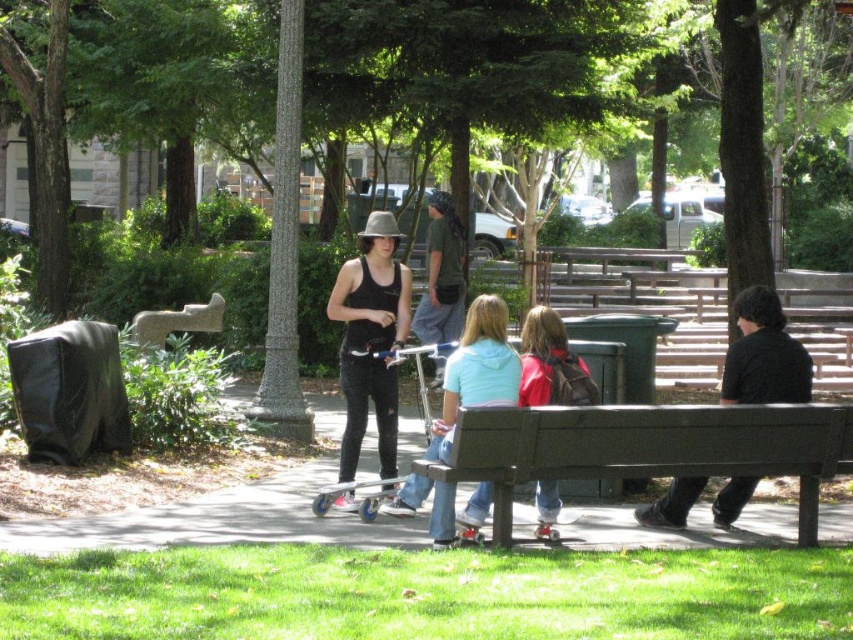
You are a photographer trying to capture a candid shot of the two people at the park. You notice the matte black tank top at center and the light blue cotton hoodie at center. Which clothing item would appear larger in your photo?

The matte black tank top at center would appear larger in the photo since it is much taller than the light blue cotton hoodie at center.